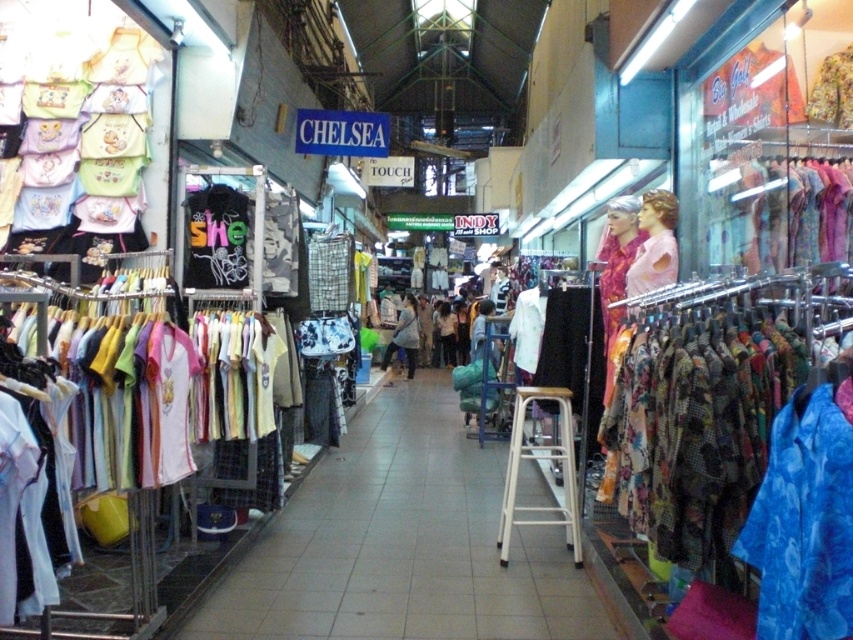
Question: Is white metal stool at center above pink fabric doll at upper right?

Choices:
 (A) yes
 (B) no

Answer: (B)

Question: Among these objects, which one is farthest from the camera?

Choices:
 (A) matte pink dress at center
 (B) printed fabric dress at right
 (C) white fabric shirts at center

Answer: (A)

Question: Does white metal stool at center appear over pink fabric doll at upper right?

Choices:
 (A) yes
 (B) no

Answer: (B)

Question: Which of the following is the farthest from the observer?

Choices:
 (A) (564, 620)
 (B) (621, 282)

Answer: (B)

Question: Which point appears closest to the camera in this image?

Choices:
 (A) (782, 202)
 (B) (799, 477)

Answer: (B)

Question: Does printed fabric dress at right appear on the left side of floral fabric dress at center?

Choices:
 (A) yes
 (B) no

Answer: (B)